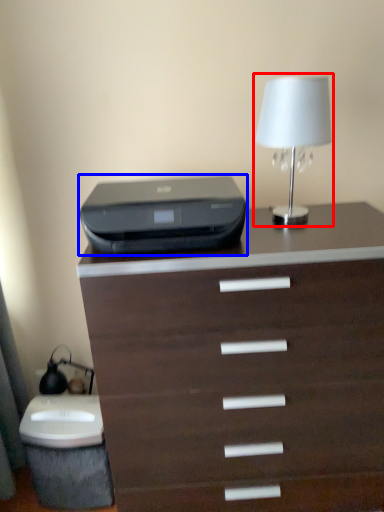
Question: Which point is further to the camera, table lamp (highlighted by a red box) or printer (highlighted by a blue box)?

Choices:
 (A) table lamp
 (B) printer

Answer: (A)